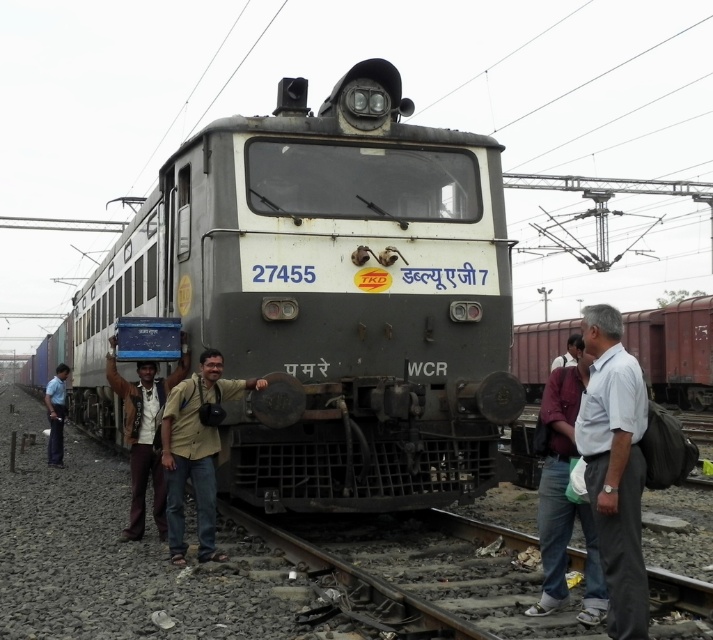
Can you confirm if gray metallic train at center is positioned above rusty metal freight car at right?

Yes, gray metallic train at center is above rusty metal freight car at right.

Is gray metallic train at center shorter than rusty metal freight car at right?

In fact, gray metallic train at center may be taller than rusty metal freight car at right.

What do you see at coordinates (327, 298) in the screenshot?
I see `gray metallic train at center` at bounding box center [327, 298].

This screenshot has width=713, height=640. I want to click on gray metallic train at center, so click(x=327, y=298).

The image size is (713, 640). What do you see at coordinates (564, 497) in the screenshot?
I see `maroon fabric shirt at right` at bounding box center [564, 497].

Who is positioned more to the right, maroon fabric shirt at right or dark blue jeans at lower left?

Positioned to the right is maroon fabric shirt at right.

Is point (550, 547) behind point (56, 445)?

No, (550, 547) is in front of (56, 445).

You are a GUI agent. You are given a task and a screenshot of the screen. Output one action in this format:
    pyautogui.click(x=<x>, y=<y>)
    Task: Click on the maroon fabric shirt at right
    
    Given the screenshot: What is the action you would take?
    pyautogui.click(x=564, y=497)

Does gray metallic train at center appear over beige fabric shirt at center?

Yes.

Who is more forward, (143, 246) or (212, 476)?

Point (212, 476) is more forward.

The image size is (713, 640). In order to click on gray metallic train at center in this screenshot , I will do `click(327, 298)`.